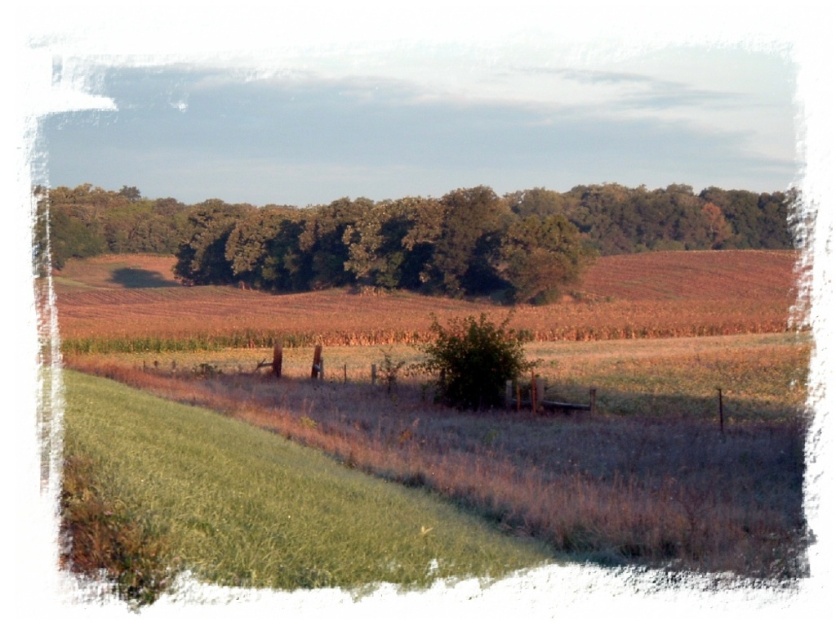
Can you confirm if green grass at lower left is thinner than green leafy trees at center?

Yes, green grass at lower left is thinner than green leafy trees at center.

You are a GUI agent. You are given a task and a screenshot of the screen. Output one action in this format:
    pyautogui.click(x=<x>, y=<y>)
    Task: Click on the green grass at lower left
    This screenshot has width=836, height=640.
    Given the screenshot: What is the action you would take?
    pyautogui.click(x=266, y=499)

This screenshot has width=836, height=640. What do you see at coordinates (266, 499) in the screenshot?
I see `green grass at lower left` at bounding box center [266, 499].

Locate an element on the screen. This screenshot has width=836, height=640. green grass at lower left is located at coordinates (266, 499).